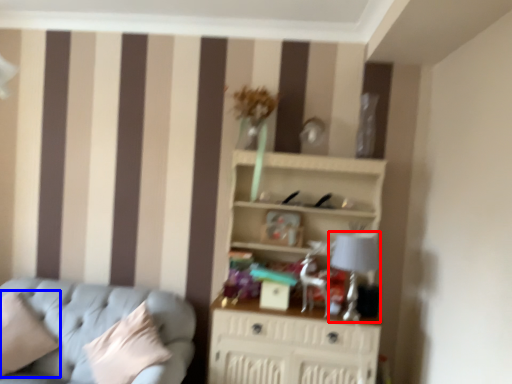
Question: Which object is further to the camera taking this photo, table lamp (highlighted by a red box) or pillow (highlighted by a blue box)?

Choices:
 (A) table lamp
 (B) pillow

Answer: (A)